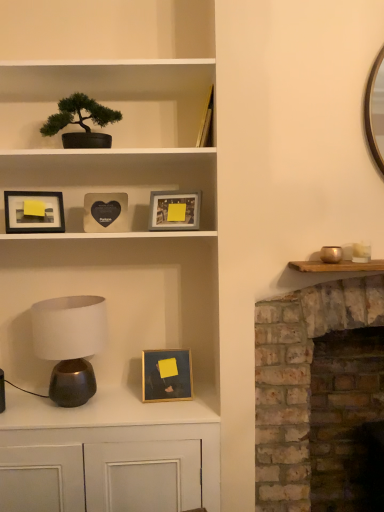
Find the location of a particular element. This screenshot has width=384, height=512. satin white lampshade at lower left is located at coordinates (70, 344).

Measure the distance between point (x=159, y=201) and camera.

1.80 meters.

Image resolution: width=384 pixels, height=512 pixels. Describe the element at coordinates (174, 211) in the screenshot. I see `matte gray picture frame at upper center, which is the fourth picture frame in left-to-right order` at that location.

What is the approximate height of brick fireplace at right?

1.30 meters.

Identify the location of matte black cabinet at center. (116, 423).

From a real-world perspective, between satin white lampshade at lower left and green matte bonsai tree at upper left, who is vertically lower?

satin white lampshade at lower left.

Is satin white lampshade at lower left positioned beyond the bounds of green matte bonsai tree at upper left?

Yes, satin white lampshade at lower left is outside of green matte bonsai tree at upper left.

Considering the sizes of objects satin white lampshade at lower left and green matte bonsai tree at upper left in the image provided, who is thinner, satin white lampshade at lower left or green matte bonsai tree at upper left?

green matte bonsai tree at upper left is thinner.

Which of these two, satin white lampshade at lower left or green matte bonsai tree at upper left, is bigger?

satin white lampshade at lower left is bigger.

Based on the photo, from the image's perspective, would you say matte gray picture frame at upper center, the first picture frame in the right-to-left sequence, is shown under matte black bonsai tree at upper left?

Yes, from the image's perspective, matte gray picture frame at upper center, the first picture frame in the right-to-left sequence, is below matte black bonsai tree at upper left.

Which of these two, matte gray picture frame at upper center, which is the fourth picture frame in left-to-right order, or matte black bonsai tree at upper left, is smaller?

Smaller between the two is matte gray picture frame at upper center, which is the fourth picture frame in left-to-right order.

Which object is positioned more to the right, matte gray picture frame at upper center, the first picture frame in the right-to-left sequence, or matte black bonsai tree at upper left?

From the viewer's perspective, matte gray picture frame at upper center, the first picture frame in the right-to-left sequence, appears more on the right side.

Is gold/glossy picture frame at center, the 4th picture frame in the top-to-bottom sequence, bigger than gold metallic bowl at right?

Indeed, gold/glossy picture frame at center, the 4th picture frame in the top-to-bottom sequence, has a larger size compared to gold metallic bowl at right.

From the picture: From the image's perspective, relative to gold metallic bowl at right, is gold/glossy picture frame at center, the 2th picture frame positioned from the right, above or below?

Based on their image positions, gold/glossy picture frame at center, the 2th picture frame positioned from the right, is located beneath gold metallic bowl at right.

Starting from the gold metallic bowl at right, which picture frame is the 4th one behind? Please provide its 2D coordinates.

[(166, 375)]

From a real-world perspective, is gold/glossy picture frame at center, which appears as the third picture frame when viewed from the left, beneath gold metallic bowl at right?

Yes.

From the image's perspective, is matte black frame at upper left, the 3th picture frame in the top-to-bottom sequence, located above satin white lampshade at lower left?

Correct, matte black frame at upper left, the 3th picture frame in the top-to-bottom sequence, appears higher than satin white lampshade at lower left in the image.

From a real-world perspective, who is located higher, matte black frame at upper left, the first picture frame when ordered from left to right, or satin white lampshade at lower left?

From a 3D spatial view, matte black frame at upper left, the first picture frame when ordered from left to right, is above.

Between matte black frame at upper left, the first picture frame when ordered from left to right, and satin white lampshade at lower left, which one appears on the right side from the viewer's perspective?

Positioned to the right is satin white lampshade at lower left.

Would you say matte black frame at upper left, the 3th picture frame in the top-to-bottom sequence, is inside or outside satin white lampshade at lower left?

matte black frame at upper left, the 3th picture frame in the top-to-bottom sequence, lies outside satin white lampshade at lower left.

Which is in front, point (25, 231) or point (70, 98)?

The point (25, 231) is in front.

What's the angular difference between matte black frame at upper left, the 3th picture frame in the top-to-bottom sequence, and green matte bonsai tree at upper left's facing directions?

The angular difference between matte black frame at upper left, the 3th picture frame in the top-to-bottom sequence, and green matte bonsai tree at upper left is 19.7 degrees.

Is matte black frame at upper left, the first picture frame when ordered from left to right, inside or outside of green matte bonsai tree at upper left?

matte black frame at upper left, the first picture frame when ordered from left to right, exists outside the volume of green matte bonsai tree at upper left.

Which object is positioned more to the left, green matte bonsai tree at upper left or matte black frame at upper left, the 3th picture frame in the top-to-bottom sequence?

Positioned to the left is matte black frame at upper left, the 3th picture frame in the top-to-bottom sequence.

Is green matte bonsai tree at upper left next to matte black frame at upper left, the 3th picture frame in the top-to-bottom sequence, and touching it?

No, green matte bonsai tree at upper left is not making contact with matte black frame at upper left, the 3th picture frame in the top-to-bottom sequence.

In terms of height, does green matte bonsai tree at upper left look taller or shorter compared to matte black frame at upper left, the first picture frame when ordered from left to right?

In the image, green matte bonsai tree at upper left appears to be taller than matte black frame at upper left, the first picture frame when ordered from left to right.

Is point (64, 116) behind point (61, 193)?

No, it is in front of (61, 193).

Identify the location of candle holder that is on the left side of brick fireplace at right. (331, 254).

Can you confirm if brick fireplace at right is shorter than gold metallic bowl at right?

Incorrect, the height of brick fireplace at right does not fall short of that of gold metallic bowl at right.

Is brick fireplace at right outside of gold metallic bowl at right?

Yes.

Considering the relative sizes of brick fireplace at right and gold metallic bowl at right in the image provided, is brick fireplace at right smaller than gold metallic bowl at right?

Actually, brick fireplace at right might be larger than gold metallic bowl at right.

Locate an element on the screen. The width and height of the screenshot is (384, 512). plant on the right of satin white lampshade at lower left is located at coordinates (79, 114).

In order to click on picture frame that is the 2nd object located below the matte black bonsai tree at upper left (from the image's perspective) in this screenshot , I will do `click(174, 211)`.

From the image, which object appears to be farther from matte black frame at upper left, the first picture frame when ordered from left to right, matte black bonsai tree at upper left or gold metallic bowl at right?

Among the two, gold metallic bowl at right is located further to matte black frame at upper left, the first picture frame when ordered from left to right.

Considering their positions, is matte black frame at upper left, the first picture frame when ordered from left to right, positioned further to gold/glossy picture frame at center, the 1th picture frame positioned from the bottom, than matte gray picture frame at upper center, which is the 2th picture frame in top-to-bottom order?

matte black frame at upper left, the first picture frame when ordered from left to right, is further to gold/glossy picture frame at center, the 1th picture frame positioned from the bottom.

Based on their spatial positions, is matte black cabinet at center or black matte heart-shaped object at upper center, acting as the 3th picture frame starting from the right, closer to matte gray picture frame at upper center, the first picture frame in the right-to-left sequence?

The object closer to matte gray picture frame at upper center, the first picture frame in the right-to-left sequence, is black matte heart-shaped object at upper center, acting as the 3th picture frame starting from the right.

Considering their positions, is gold/glossy picture frame at center, which appears as the third picture frame when viewed from the left, positioned further to matte black bonsai tree at upper left than satin white lampshade at lower left?

Among the two, gold/glossy picture frame at center, which appears as the third picture frame when viewed from the left, is located further to matte black bonsai tree at upper left.

Looking at the image, which one is located closer to black matte heart-shaped object at upper center, acting as the 3th picture frame starting from the right, matte gray picture frame at upper center, the first picture frame in the right-to-left sequence, or gold/glossy picture frame at center, which appears as the third picture frame when viewed from the left?

matte gray picture frame at upper center, the first picture frame in the right-to-left sequence, is closer to black matte heart-shaped object at upper center, acting as the 3th picture frame starting from the right.

Estimate the real-world distances between objects in this image. Which object is closer to matte black cabinet at center, green matte bonsai tree at upper left or gold metallic bowl at right?

gold metallic bowl at right.

When comparing their distances from satin white lampshade at lower left, does brick fireplace at right or matte black bonsai tree at upper left seem closer?

brick fireplace at right is positioned closer to the anchor satin white lampshade at lower left.

Which object lies further to the anchor point matte black frame at upper left, the 3th picture frame in the top-to-bottom sequence, matte gray picture frame at upper center, acting as the 3th picture frame starting from the bottom, or matte black cabinet at center?

matte black cabinet at center.

Where is `candle holder situated between matte black frame at upper left, acting as the second picture frame starting from the bottom, and brick fireplace at right from left to right`? This screenshot has width=384, height=512. candle holder situated between matte black frame at upper left, acting as the second picture frame starting from the bottom, and brick fireplace at right from left to right is located at coordinates (331, 254).

Where is `shelf situated between satin white lampshade at lower left and gold metallic bowl at right from left to right`? The width and height of the screenshot is (384, 512). shelf situated between satin white lampshade at lower left and gold metallic bowl at right from left to right is located at coordinates (108, 100).

Locate an element on the screen. candle holder between black matte heart-shaped object at upper center, the 4th picture frame positioned from the bottom, and matte black cabinet at center vertically is located at coordinates (331, 254).

You are a GUI agent. You are given a task and a screenshot of the screen. Output one action in this format:
    pyautogui.click(x=<x>, y=<y>)
    Task: Click on the candle holder between matte gray picture frame at upper center, the first picture frame in the right-to-left sequence, and gold/glossy picture frame at center, the 2th picture frame positioned from the right, in the vertical direction
    Image resolution: width=384 pixels, height=512 pixels.
    Given the screenshot: What is the action you would take?
    pyautogui.click(x=331, y=254)